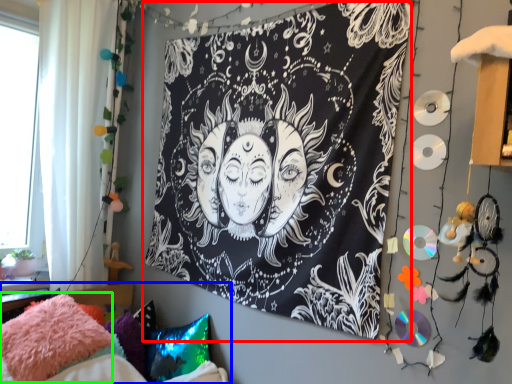
Question: Which object is the closest to the bulletin board (highlighted by a red box)? Choose among these: furniture (highlighted by a blue box) or pillow (highlighted by a green box).

Choices:
 (A) furniture
 (B) pillow

Answer: (A)